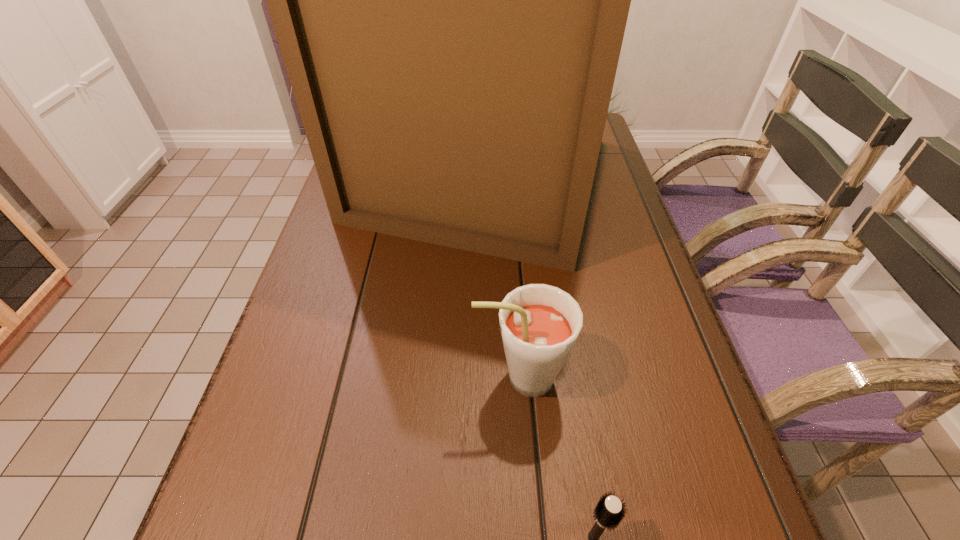
At what (x,y) coordinates should I click in order to perform the action: click on object that is at the right edge. Please return your answer as a coordinate pair (x, y). Image resolution: width=960 pixels, height=540 pixels. Looking at the image, I should click on (450, 0).

Image resolution: width=960 pixels, height=540 pixels. In order to click on object positioned at the far left corner in this screenshot , I will do `click(450, 0)`.

Where is `object positioned at the far right corner`? object positioned at the far right corner is located at coordinates (450, 0).

At what (x,y) coordinates should I click in order to perform the action: click on free region at the left edge of the desktop. Please return your answer as a coordinate pair (x, y). Image resolution: width=960 pixels, height=540 pixels. Looking at the image, I should click on (353, 371).

Select which object appears as the second closest to the root beer. Please provide its 2D coordinates. Your answer should be formatted as a tuple, i.e. [(x, y)], where the tuple contains the x and y coordinates of a point satisfying the conditions above.

[(450, 0)]

Locate which object ranks in proximity to the hairbrush. Please provide its 2D coordinates. Your answer should be formatted as a tuple, i.e. [(x, y)], where the tuple contains the x and y coordinates of a point satisfying the conditions above.

[(539, 324)]